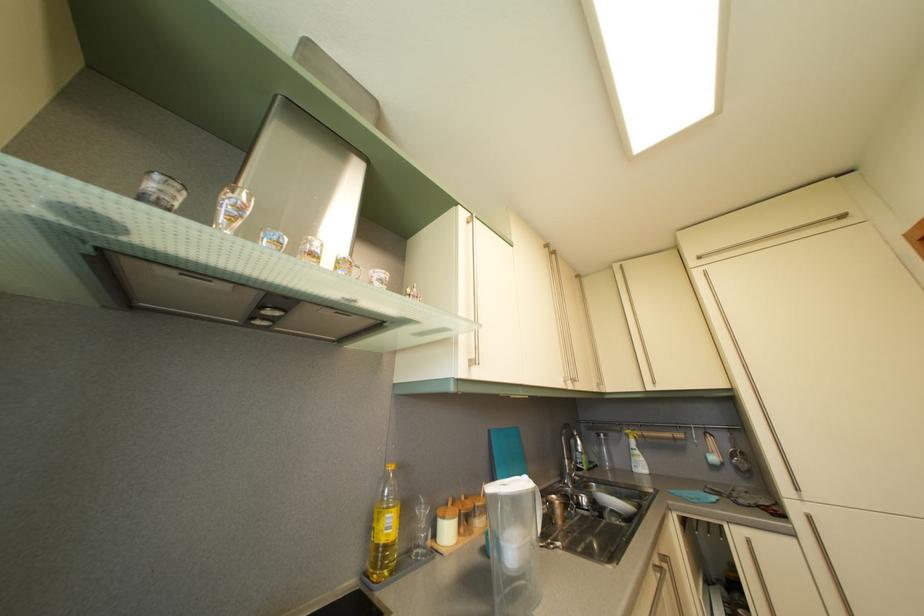
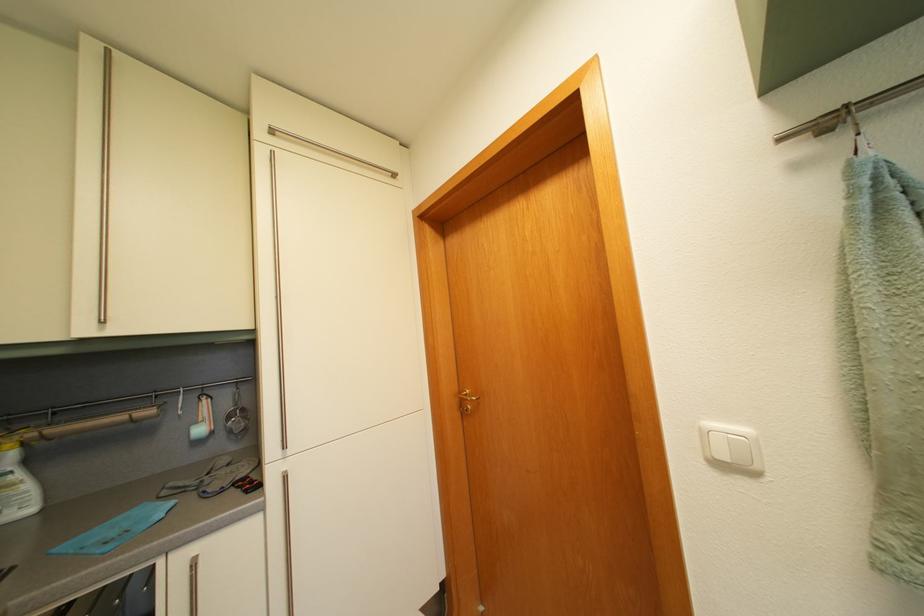
Find the pixel in the second image that matches (709,261) in the first image.

(284, 132)